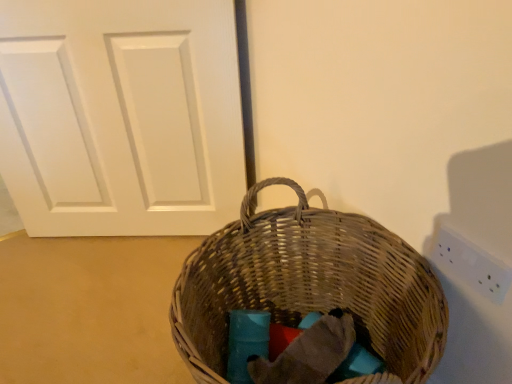
This screenshot has width=512, height=384. Find the location of `white plastic electric outlet at upper right`. white plastic electric outlet at upper right is located at coordinates (470, 264).

This screenshot has height=384, width=512. I want to click on woven brown picnic basket at center, so click(310, 286).

Describe the element at coordinates (121, 116) in the screenshot. I see `white matte door at center` at that location.

I want to click on white plastic electric outlet at upper right, so click(470, 264).

Who is shorter, white plastic electric outlet at upper right or woven brown picnic basket at center?

With less height is white plastic electric outlet at upper right.

From a real-world perspective, is white plastic electric outlet at upper right physically above woven brown picnic basket at center?

Yes, from a real-world perspective, white plastic electric outlet at upper right is on top of woven brown picnic basket at center.

Considering the positions of points (499, 281) and (272, 211), is point (499, 281) closer to camera compared to point (272, 211)?

Yes.

From the picture: Who is more distant, white plastic electric outlet at upper right or woven brown picnic basket at center?

white plastic electric outlet at upper right is more distant.

Does point (231, 8) come in front of point (442, 251)?

That is False.

Which object is thinner, white matte door at center or white plastic electric outlet at upper right?

white plastic electric outlet at upper right is thinner.

You are a GUI agent. You are given a task and a screenshot of the screen. Output one action in this format:
    pyautogui.click(x=<x>, y=<y>)
    Task: Click on the electric outlet below the white matte door at center (from the image's perspective)
    
    Given the screenshot: What is the action you would take?
    pyautogui.click(x=470, y=264)

How many degrees apart are the facing directions of woven brown picnic basket at center and white plastic electric outlet at upper right?

There is a 0.193-degree angle between the facing directions of woven brown picnic basket at center and white plastic electric outlet at upper right.

Is woven brown picnic basket at center not within white plastic electric outlet at upper right?

Indeed, woven brown picnic basket at center is completely outside white plastic electric outlet at upper right.

Is point (292, 248) positioned behind point (493, 291)?

That is True.

Between woven brown picnic basket at center and white plastic electric outlet at upper right, which one has larger size?

woven brown picnic basket at center is bigger.

From the image's perspective, would you say white plastic electric outlet at upper right is shown under white matte door at center?

Correct, white plastic electric outlet at upper right appears lower than white matte door at center in the image.

Considering the relative positions of white plastic electric outlet at upper right and white matte door at center in the image provided, is white plastic electric outlet at upper right to the left of white matte door at center from the viewer's perspective?

In fact, white plastic electric outlet at upper right is to the right of white matte door at center.

Considering the relative sizes of white plastic electric outlet at upper right and white matte door at center in the image provided, is white plastic electric outlet at upper right taller than white matte door at center?

In fact, white plastic electric outlet at upper right may be shorter than white matte door at center.

Between point (496, 259) and point (130, 221), which one is positioned in front?

The point (496, 259) is in front.

Are white matte door at center and woven brown picnic basket at center beside each other?

They are not placed beside each other.

Would you say white matte door at center is to the left or to the right of woven brown picnic basket at center in the picture?

From the image, it's evident that white matte door at center is to the left of woven brown picnic basket at center.

Between white matte door at center and woven brown picnic basket at center, which one has more height?

With more height is white matte door at center.

From the image's perspective, is white matte door at center positioned above or below woven brown picnic basket at center?

white matte door at center is above woven brown picnic basket at center.

Is point (213, 357) positioned in front of point (73, 134)?

Yes, it is.

Considering the relative positions of woven brown picnic basket at center and white matte door at center in the image provided, is woven brown picnic basket at center to the left or to the right of white matte door at center?

woven brown picnic basket at center is to the right of white matte door at center.

From the image's perspective, does woven brown picnic basket at center appear lower than white matte door at center?

Yes, from the image's perspective, woven brown picnic basket at center is below white matte door at center.

Does woven brown picnic basket at center turn towards white matte door at center?

No, woven brown picnic basket at center is not oriented towards white matte door at center.

The width and height of the screenshot is (512, 384). I want to click on picnic basket located on the left of white plastic electric outlet at upper right, so click(x=310, y=286).

At what (x,y) coordinates should I click in order to perform the action: click on door located behind the white plastic electric outlet at upper right. Please return your answer as a coordinate pair (x, y). Image resolution: width=512 pixels, height=384 pixels. Looking at the image, I should click on (121, 116).

Estimate the real-world distances between objects in this image. Which object is further from white plastic electric outlet at upper right, woven brown picnic basket at center or white matte door at center?

white matte door at center.

Looking at the image, which one is located further to woven brown picnic basket at center, white matte door at center or white plastic electric outlet at upper right?

white matte door at center is further to woven brown picnic basket at center.

Based on their spatial positions, is woven brown picnic basket at center or white plastic electric outlet at upper right further from white matte door at center?

Among the two, white plastic electric outlet at upper right is located further to white matte door at center.

Considering their positions, is white matte door at center positioned closer to white plastic electric outlet at upper right than woven brown picnic basket at center?

Among the two, woven brown picnic basket at center is located nearer to white plastic electric outlet at upper right.

Estimate the real-world distances between objects in this image. Which object is further from woven brown picnic basket at center, white plastic electric outlet at upper right or white matte door at center?

Based on the image, white matte door at center appears to be further to woven brown picnic basket at center.

From the image, which object appears to be farther from white matte door at center, white plastic electric outlet at upper right or woven brown picnic basket at center?

white plastic electric outlet at upper right.

At what (x,y) coordinates should I click in order to perform the action: click on picnic basket located between white matte door at center and white plastic electric outlet at upper right in the left-right direction. Please return your answer as a coordinate pair (x, y). The height and width of the screenshot is (384, 512). Looking at the image, I should click on (310, 286).